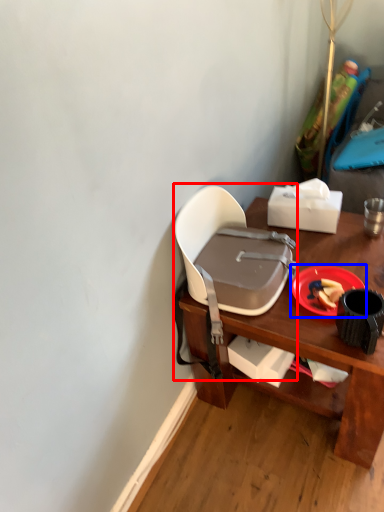
Question: Which object is closer to the camera taking this photo, chair (highlighted by a red box) or plate (highlighted by a blue box)?

Choices:
 (A) chair
 (B) plate

Answer: (A)